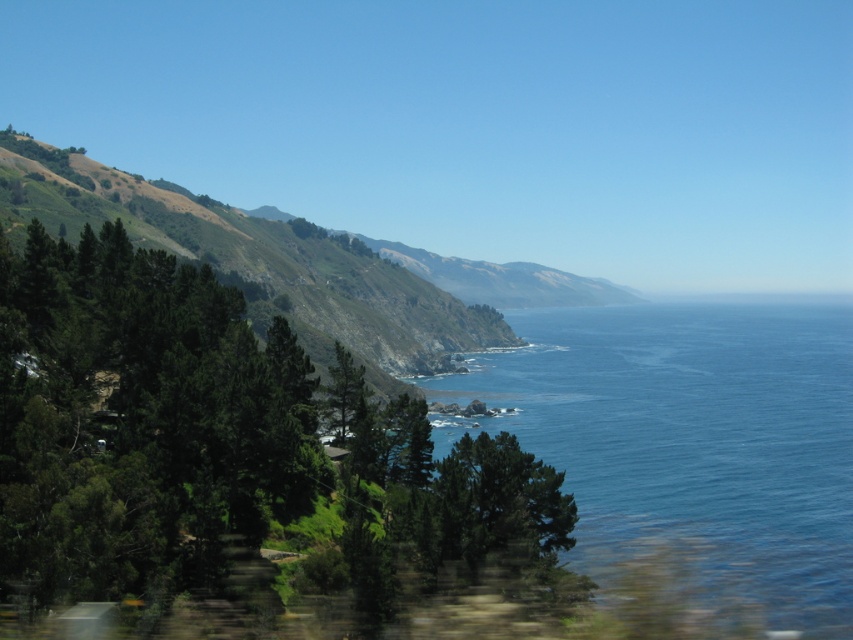
You are standing at the center of the image and want to take a photo of the green leafy tree at left. In which direction should you point your camera?

The green leafy tree at left is located at the left side of the image, so you should point your camera to the left to capture it in the photo.

Based on the photo, you are a bird soaring over the coastal landscape. You see the green leafy tree at left and the blue liquid water at center. Which object is positioned higher from the ground level?

The green leafy tree at left is above the blue liquid water at center, so it is positioned higher from the ground level.

You are a photographer planning to capture the entire scene in one shot. Given that your camera can only focus on objects within a 10m width, which object between the blue liquid water at center and the green leafy hillside at left would require you to adjust your focus settings to ensure it is fully captured?

The blue liquid water at center has a larger width than the green leafy hillside at left, so you would need to adjust your focus settings to accommodate its greater width to ensure it is fully captured.